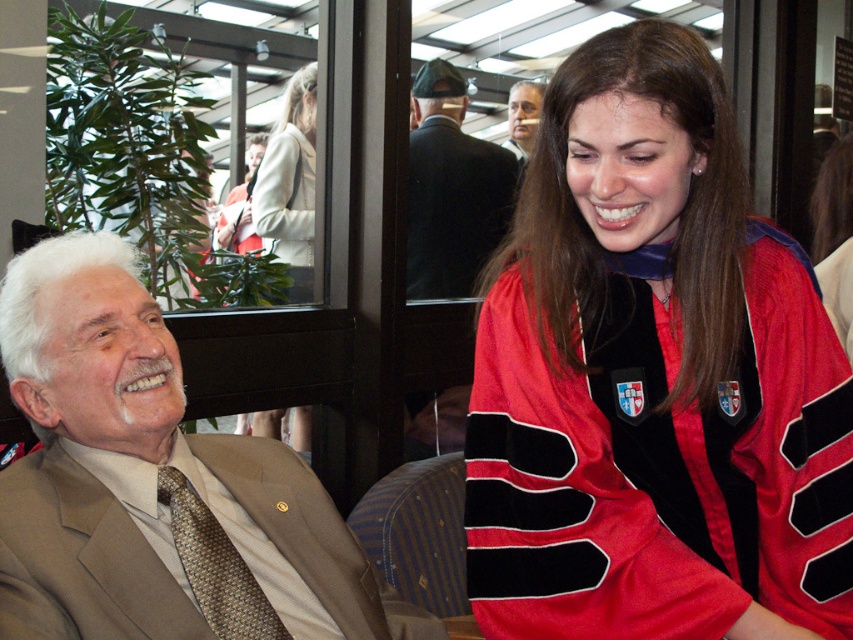
Is white wool coat at upper center above matte black tie at upper center?

Actually, white wool coat at upper center is below matte black tie at upper center.

Image resolution: width=853 pixels, height=640 pixels. I want to click on white wool coat at upper center, so click(x=289, y=184).

Does point (294, 97) come closer to viewer compared to point (231, 218)?

Yes, it is in front of point (231, 218).

Identify the location of white wool coat at upper center. (289, 184).

Who is lower down, beige textured suit at left or white wool coat at upper center?

beige textured suit at left

Describe the element at coordinates (79, 561) in the screenshot. The width and height of the screenshot is (853, 640). I see `beige textured suit at left` at that location.

Where is `beige textured suit at left`? The height and width of the screenshot is (640, 853). beige textured suit at left is located at coordinates (79, 561).

Consider the image. Which is above, velvet red graduation gown at center or brown textured tie at left?

velvet red graduation gown at center

Who is taller, velvet red graduation gown at center or brown textured tie at left?

velvet red graduation gown at center

Who is more distant from viewer, (566,308) or (230,621)?

The point (230,621) is behind.

At what (x,y) coordinates should I click in order to perform the action: click on velvet red graduation gown at center. Please return your answer as a coordinate pair (x, y). Image resolution: width=853 pixels, height=640 pixels. Looking at the image, I should click on (653, 378).